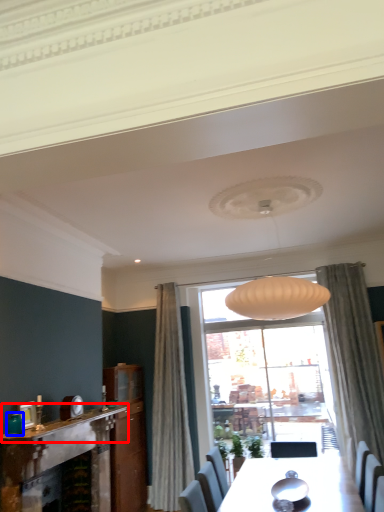
Question: Among these objects, which one is nearest to the camera, mantle (highlighted by a red box) or teal (highlighted by a blue box)?

Choices:
 (A) mantle
 (B) teal

Answer: (A)